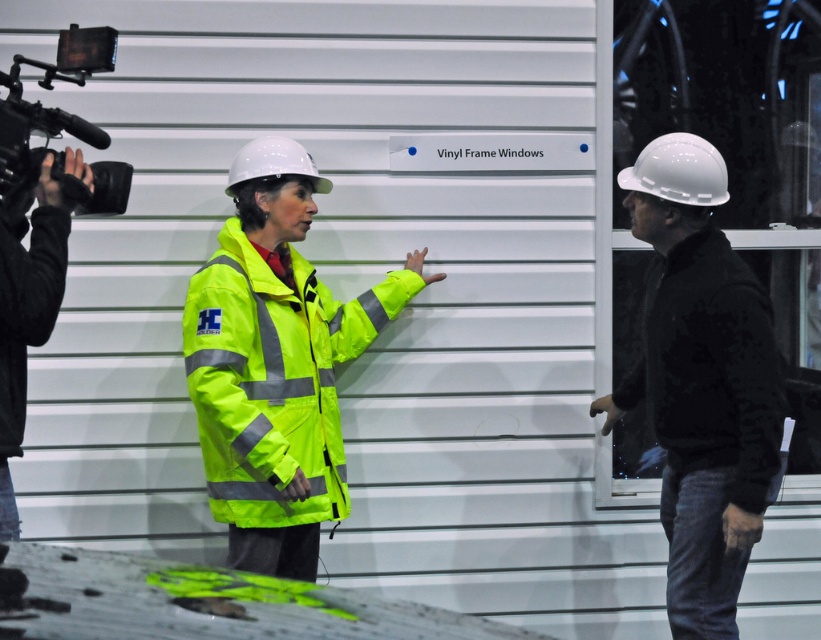
Question: Can you confirm if neon yellow reflective jacket at center is smaller than black velvet jacket at right?

Choices:
 (A) no
 (B) yes

Answer: (A)

Question: Is black velvet jacket at right smaller than black matte video camera at upper left?

Choices:
 (A) yes
 (B) no

Answer: (B)

Question: Which is farther from the black matte video camera at upper left?

Choices:
 (A) neon yellow reflective jacket at center
 (B) black fabric camera at left
 (C) black velvet jacket at right

Answer: (C)

Question: Among these objects, which one is farthest from the camera?

Choices:
 (A) black velvet jacket at right
 (B) neon yellow reflective jacket at center
 (C) black fabric camera at left

Answer: (B)

Question: Considering the real-world distances, which object is closest to the black matte video camera at upper left?

Choices:
 (A) black velvet jacket at right
 (B) neon yellow reflective jacket at center
 (C) black fabric camera at left

Answer: (C)

Question: Does neon yellow reflective jacket at center come behind black velvet jacket at right?

Choices:
 (A) no
 (B) yes

Answer: (B)